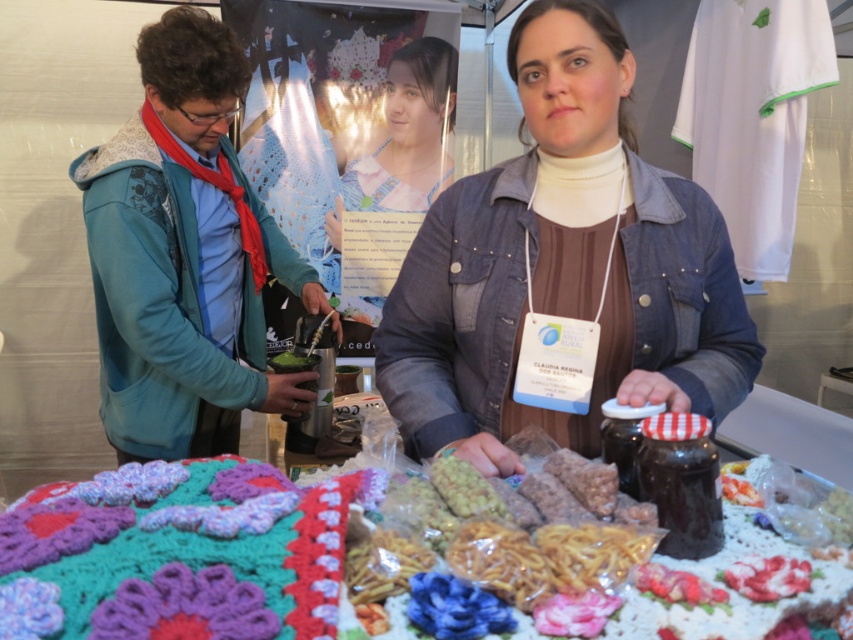
You are standing at the craft fair and want to move from the point labeled as point (x=108, y=144) to the point labeled as point (x=432, y=86). Which direction should you face to walk towards the second point?

To move from point (x=108, y=144) to point (x=432, y=86), you should face north because point (x=108, y=144) is in front of point (x=432, y=86), indicating that the second point is behind the first one in the image.

You are a customer at the craft fair and see the blue fleece jacket at left and the knitted fabric at lower left. Which item is placed on top of the other?

The blue fleece jacket at left is positioned over the knitted fabric at lower left, so it is placed on top.

You are a customer at the craft fair and want to pick up the knitted fabric at lower left. Can you reach it without moving the blue fleece jacket at left?

The knitted fabric at lower left is behind the blue fleece jacket at left, so you cannot reach it without moving the blue fleece jacket at left.